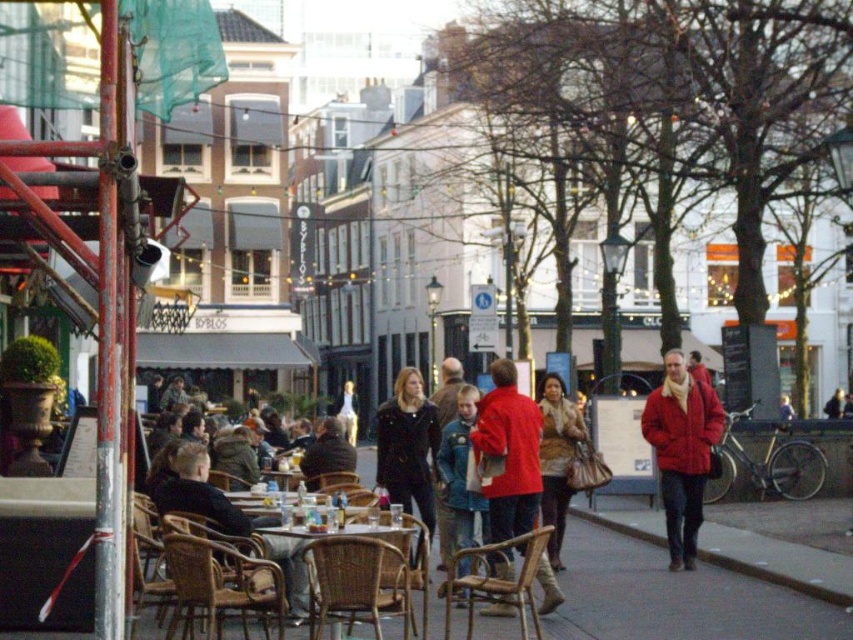
You are a delivery person carrying a box that is 1.2 meters wide. You need to pass between the red matte jacket at center and the brown woven chair at lower left. Can your box fit through the space between them?

The red matte jacket at center might be wider than brown woven chair at lower left, so the space between them may not be wide enough for a box that is 1.2 meters wide. You should check the actual width before attempting to pass.